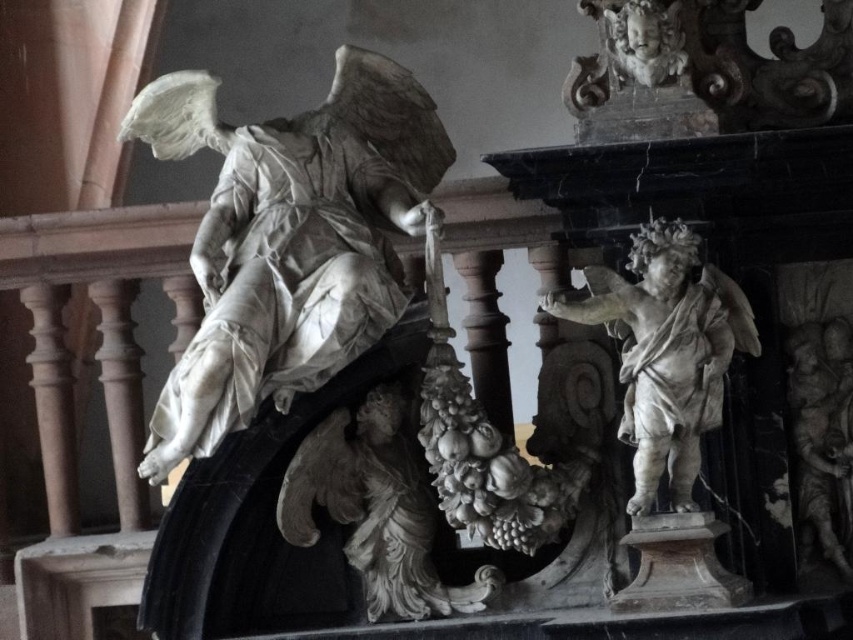
Which is in front, point (335, 269) or point (424, 516)?

Point (335, 269) is in front.

Does white marble angel at left appear under white marble grapes at center?

No, white marble angel at left is not below white marble grapes at center.

This screenshot has width=853, height=640. What do you see at coordinates (288, 240) in the screenshot? I see `white marble angel at left` at bounding box center [288, 240].

Find the location of a particular element. The width and height of the screenshot is (853, 640). white marble angel at left is located at coordinates (288, 240).

Between white marble angel at left and white marble cherub at upper right, which one has less height?

With less height is white marble cherub at upper right.

Does point (221, 220) lie in front of point (608, 54)?

Yes, point (221, 220) is in front of point (608, 54).

At what (x,y) coordinates should I click in order to perform the action: click on white marble angel at left. Please return your answer as a coordinate pair (x, y). Looking at the image, I should click on (288, 240).

Is smooth gray cherub at right to the right of white marble cherub at upper right from the viewer's perspective?

Yes, smooth gray cherub at right is to the right of white marble cherub at upper right.

Is point (836, 404) farther from camera compared to point (653, 6)?

Yes, point (836, 404) is farther from viewer.

The width and height of the screenshot is (853, 640). In order to click on smooth gray cherub at right in this screenshot , I will do `click(822, 436)`.